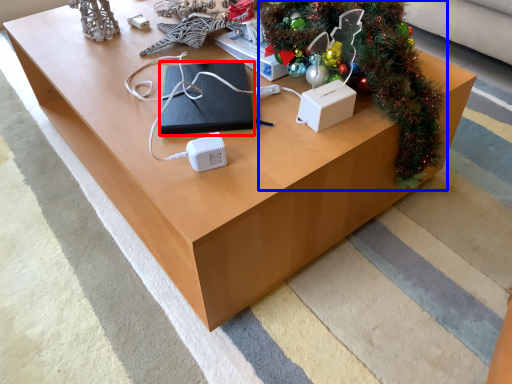
Question: Which of the following is the farthest to the observer, pad (highlighted by a red box) or christmas tree (highlighted by a blue box)?

Choices:
 (A) pad
 (B) christmas tree

Answer: (A)